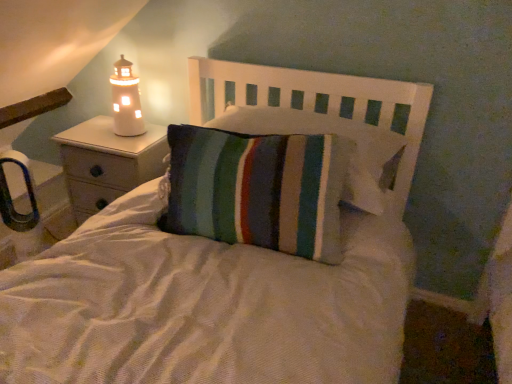
Question: From a real-world perspective, is striped fabric pillow at center positioned above or below striped fabric pillow at center?

Choices:
 (A) below
 (B) above

Answer: (B)

Question: Relative to striped fabric pillow at center, is striped fabric pillow at center in front or behind?

Choices:
 (A) behind
 (B) front

Answer: (A)

Question: Considering the real-world distances, which object is farthest from the striped fabric pillow at center?

Choices:
 (A) white ceramic lighthouse at left
 (B) matte white nightstand at left
 (C) striped fabric pillow at center

Answer: (A)

Question: Which is farther from the striped fabric pillow at center?

Choices:
 (A) striped fabric pillow at center
 (B) white ceramic lighthouse at left
 (C) matte white nightstand at left

Answer: (B)